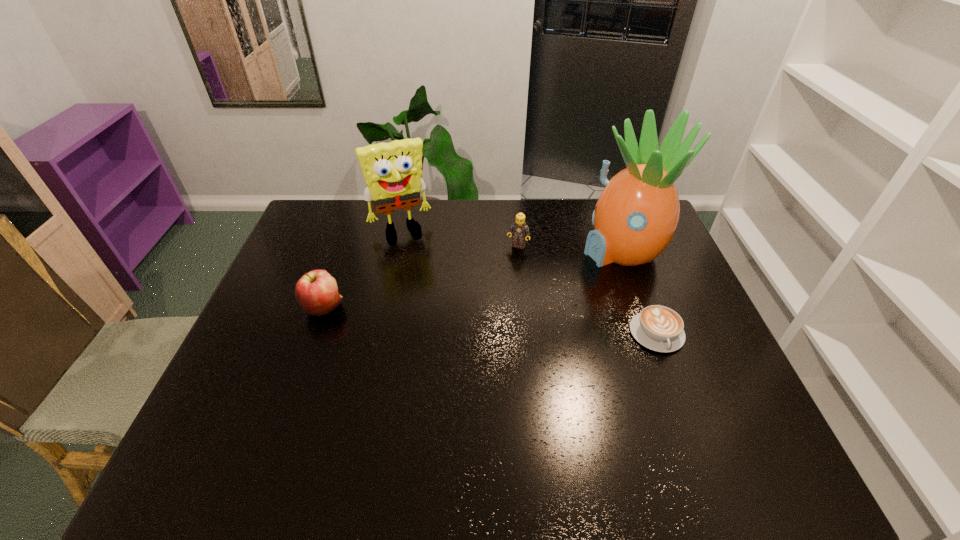
Find the location of a particular element. This screenshot has height=540, width=960. vacant area situated 0.160m in front of the Lego is located at coordinates (501, 281).

The width and height of the screenshot is (960, 540). I want to click on free space located 0.090m on the face of the sponge, so click(417, 257).

I want to click on vacant space positioned 0.090m on the face of the sponge, so click(x=417, y=257).

Identify the location of vacant space located 0.340m on the face of the sponge. Image resolution: width=960 pixels, height=540 pixels. (440, 310).

Locate an element on the screen. This screenshot has width=960, height=540. vacant space located at the entrance of the tallest object is located at coordinates (488, 299).

What are the coordinates of `vacant point located 0.160m at the entrance of the tallest object` in the screenshot? It's located at (548, 276).

The image size is (960, 540). I want to click on free space located 0.110m at the entrance of the tallest object, so click(562, 272).

Where is `sponge present at the far edge`? sponge present at the far edge is located at coordinates (392, 171).

Image resolution: width=960 pixels, height=540 pixels. Find the location of `pineapple located at the far edge`. pineapple located at the far edge is located at coordinates (636, 215).

Image resolution: width=960 pixels, height=540 pixels. Identify the location of object that is at the left edge. (316, 292).